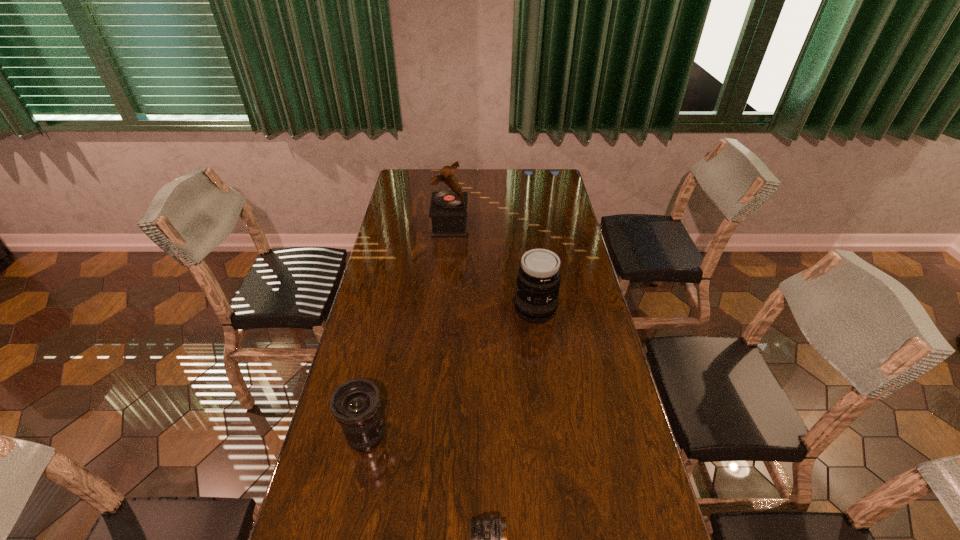
Select which object appears as the second closest to the tallest object. Please provide its 2D coordinates. Your answer should be formatted as a tuple, i.e. [(x, y)], where the tuple contains the x and y coordinates of a point satisfying the conditions above.

[(355, 404)]

Locate an element on the screen. object that stands as the closest to the tallest object is located at coordinates (536, 300).

The width and height of the screenshot is (960, 540). Find the location of `telephoto lens that is the closest to the nearest telephoto lens`. telephoto lens that is the closest to the nearest telephoto lens is located at coordinates (355, 404).

Image resolution: width=960 pixels, height=540 pixels. I want to click on telephoto lens that stands as the closest to the leftmost object, so click(x=489, y=534).

Where is `free location that satisfies the following two spatial constraints: 1. on the back side of the rightmost object; 2. at the horn opening of the phonograph_record`? The height and width of the screenshot is (540, 960). free location that satisfies the following two spatial constraints: 1. on the back side of the rightmost object; 2. at the horn opening of the phonograph_record is located at coordinates (524, 225).

Identify the location of vacant space that satisfies the following two spatial constraints: 1. at the horn opening of the rightmost telephoto lens; 2. on the left side of the tallest object. The width and height of the screenshot is (960, 540). (443, 310).